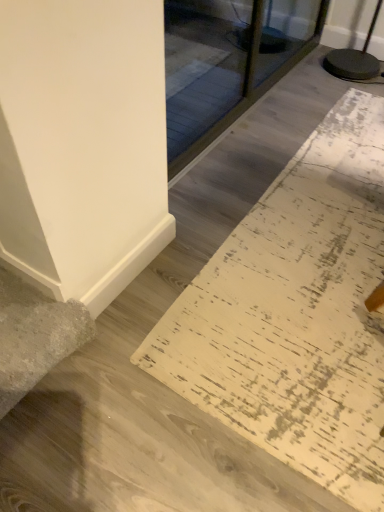
Question: From a real-world perspective, is transparent glass door at upper center physically located above or below white distressed rug at lower right?

Choices:
 (A) below
 (B) above

Answer: (B)

Question: Is transparent glass door at upper center in front of or behind white distressed rug at lower right in the image?

Choices:
 (A) behind
 (B) front

Answer: (A)

Question: From the image's perspective, is transparent glass door at upper center located above or below white distressed rug at lower right?

Choices:
 (A) above
 (B) below

Answer: (A)

Question: Looking at their shapes, would you say white distressed rug at lower right is wider or thinner than transparent glass door at upper center?

Choices:
 (A) thin
 (B) wide

Answer: (B)

Question: In the image, is white distressed rug at lower right on the left side or the right side of transparent glass door at upper center?

Choices:
 (A) right
 (B) left

Answer: (A)

Question: Considering the positions of white distressed rug at lower right and transparent glass door at upper center in the image, is white distressed rug at lower right taller or shorter than transparent glass door at upper center?

Choices:
 (A) short
 (B) tall

Answer: (A)

Question: From the image's perspective, relative to transparent glass door at upper center, is white distressed rug at lower right above or below?

Choices:
 (A) above
 (B) below

Answer: (B)